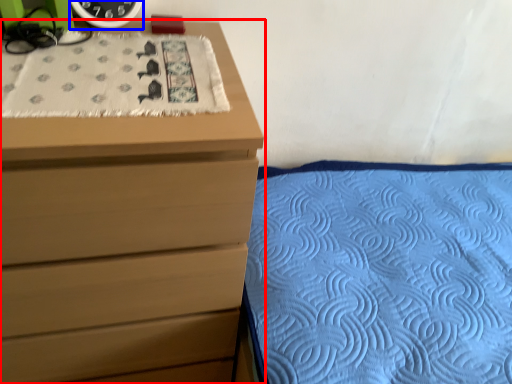
Question: Which point is closer to the camera, chest of drawers (highlighted by a red box) or clock (highlighted by a blue box)?

Choices:
 (A) chest of drawers
 (B) clock

Answer: (A)